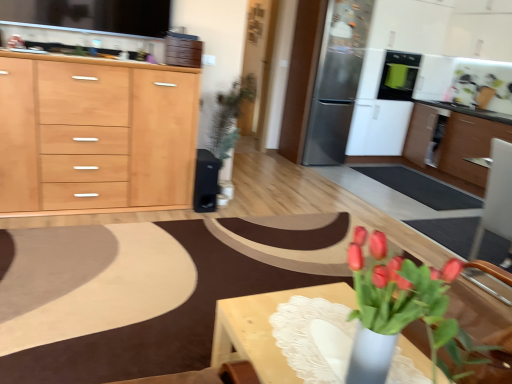
Locate an element on the screen. The width and height of the screenshot is (512, 384). unoccupied area in front of satin silver refrigerator at upper right, arranged as the second appliance when viewed from the left is located at coordinates (320, 168).